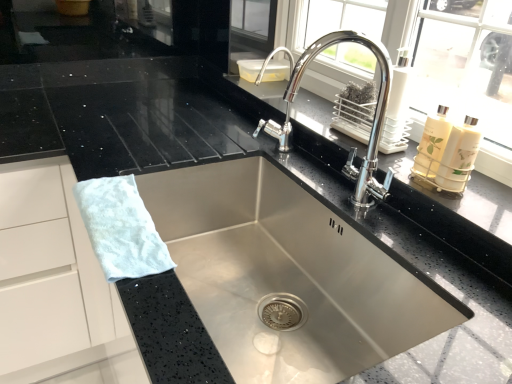
Question: In the image, is stainless steel sink at center positioned in front of or behind polished chrome faucet at upper center?

Choices:
 (A) behind
 (B) front

Answer: (B)

Question: From the image's perspective, is stainless steel sink at center positioned above or below polished chrome faucet at upper center?

Choices:
 (A) above
 (B) below

Answer: (B)

Question: Which object is the farthest from the stainless steel sink at center?

Choices:
 (A) white fluffy hand towel at left
 (B) polished chrome faucet at upper center

Answer: (A)

Question: Estimate the real-world distances between objects in this image. Which object is closer to the white fluffy hand towel at left?

Choices:
 (A) stainless steel sink at center
 (B) polished chrome faucet at upper center

Answer: (A)